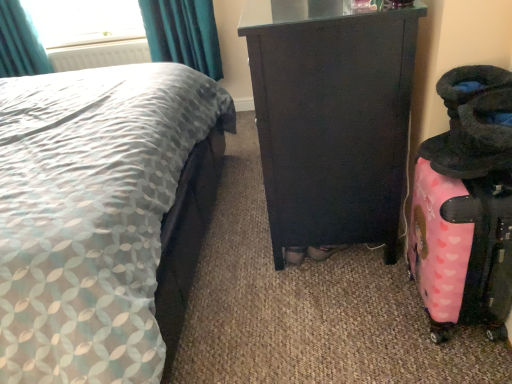
The height and width of the screenshot is (384, 512). Identify the location of vacant space situated on the left part of pink matte suitcase at right. (369, 318).